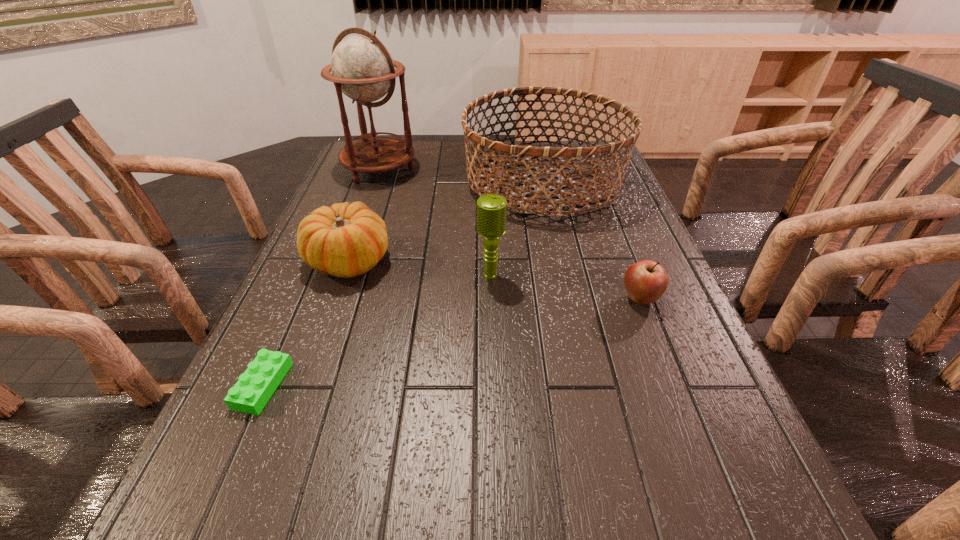
I want to click on object at the far left corner, so click(362, 68).

Where is `object that is at the far right corner`? This screenshot has height=540, width=960. object that is at the far right corner is located at coordinates (593, 151).

At what (x,y) coordinates should I click in order to perform the action: click on vacant space at the far edge of the desktop. Please return your answer as a coordinate pair (x, y). The image size is (960, 540). Looking at the image, I should click on pyautogui.click(x=478, y=163).

In the image, there is a desktop. At what (x,y) coordinates should I click in order to perform the action: click on vacant space at the left edge. Please return your answer as a coordinate pair (x, y). This screenshot has width=960, height=540. Looking at the image, I should click on (386, 185).

The image size is (960, 540). Find the location of `vacant region at the right edge`. vacant region at the right edge is located at coordinates (652, 245).

Identify the location of vacant region between the apple and the basket. The image size is (960, 540). (591, 240).

Identify the location of vacant space that is in between the tallest object and the fifth tallest object. The image size is (960, 540). (510, 234).

You are a GUI agent. You are given a task and a screenshot of the screen. Output one action in this format:
    pyautogui.click(x=<x>, y=<y>)
    Task: Click on the free space that is in between the basket and the Lego
    
    Given the screenshot: What is the action you would take?
    pyautogui.click(x=403, y=283)

Find the location of `free spot between the basket and the globe`. free spot between the basket and the globe is located at coordinates point(461,175).

Image resolution: width=960 pixels, height=540 pixels. In order to click on free space between the basket and the gourd in this screenshot , I will do `click(445, 221)`.